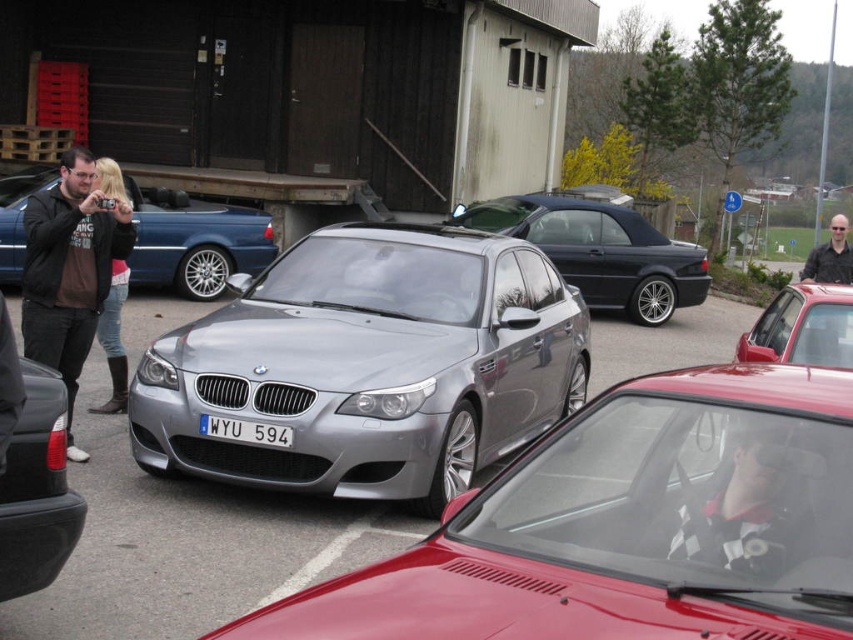
Question: Which point is farther to the camera?

Choices:
 (A) (830, 262)
 (B) (398, 234)

Answer: (A)

Question: Does satin silver car at center appear on the right side of matte black jacket at left?

Choices:
 (A) yes
 (B) no

Answer: (A)

Question: Does satin silver car at center appear over satin silver metallic sedan at left?

Choices:
 (A) no
 (B) yes

Answer: (A)

Question: Which of the following is the farthest from the observer?

Choices:
 (A) (796, 435)
 (B) (692, 520)
 (C) (761, 332)
 (D) (277, 420)

Answer: (C)

Question: From the image, what is the correct spatial relationship of checkered fabric shirt at center in relation to shiny red car at center?

Choices:
 (A) above
 (B) below

Answer: (B)

Question: Which of the following is the closest to the observer?

Choices:
 (A) checkered fabric shirt at center
 (B) denim jeans at left

Answer: (A)